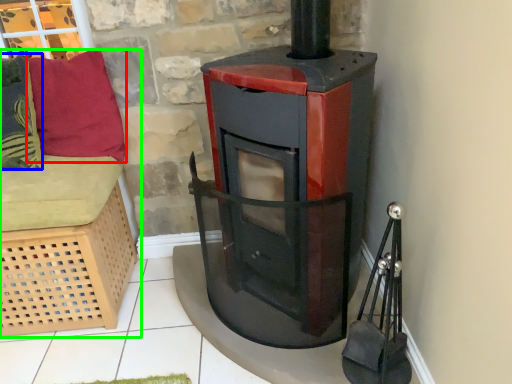
Question: Which is nearer to the pillow (highlighted by a red box)? pillow (highlighted by a blue box) or furniture (highlighted by a green box).

Choices:
 (A) pillow
 (B) furniture

Answer: (A)